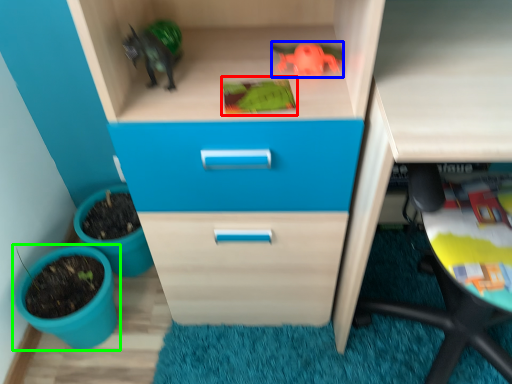
Question: Which object is the closest to the toy (highlighted by a red box)? Choose among these: toy (highlighted by a blue box) or flowerpot (highlighted by a green box).

Choices:
 (A) toy
 (B) flowerpot

Answer: (A)